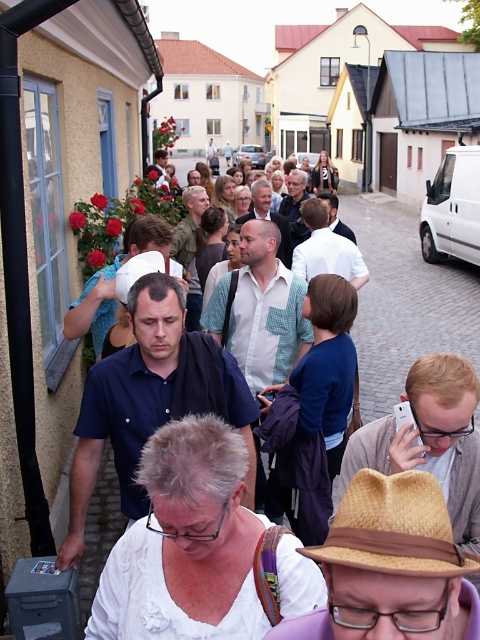
You are a photographer trying to capture a photo of two straw hats in the scene. The hats are the brown straw hat at lower center and the straw hat at center. Which hat is located to the right of the other?

The brown straw hat at lower center is positioned on the right side of the straw hat at center.

You are standing on the cobblestone street in the village and see two points marked on the ground. The first point is at coordinate point (421, 316) and the second is at point (120, 285). Which point is closer to you?

Point (421, 316) is closer to you because it is further to the viewer than point (120, 285).